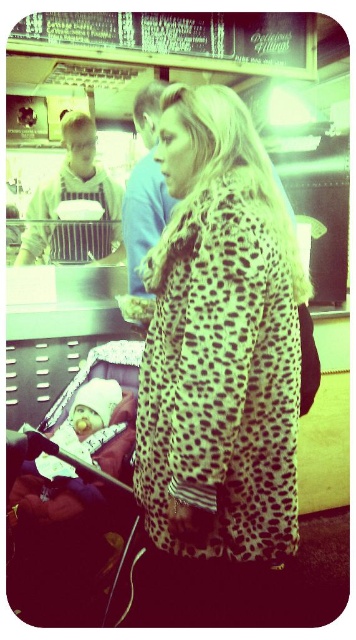
Between leopard print coat at center and soft pink fabric baby at center, which one appears on the right side from the viewer's perspective?

From the viewer's perspective, leopard print coat at center appears more on the right side.

Which is above, leopard print coat at center or soft pink fabric baby at center?

Positioned higher is leopard print coat at center.

Identify the location of leopard print coat at center. This screenshot has width=356, height=640. (220, 342).

This screenshot has width=356, height=640. Identify the location of leopard print coat at center. (220, 342).

Does leopard print coat at center have a greater height compared to metallic silver baby carriage at lower left?

Yes, leopard print coat at center is taller than metallic silver baby carriage at lower left.

Does leopard print coat at center have a larger size compared to metallic silver baby carriage at lower left?

Yes, leopard print coat at center is bigger than metallic silver baby carriage at lower left.

Find the location of a particular element. This screenshot has width=356, height=640. leopard print coat at center is located at coordinates [220, 342].

The width and height of the screenshot is (356, 640). I want to click on leopard print coat at center, so click(x=220, y=342).

Which of these two, metallic silver baby carriage at lower left or soft pink fabric baby at center, stands shorter?

Standing shorter between the two is soft pink fabric baby at center.

Is metallic silver baby carriage at lower left shorter than soft pink fabric baby at center?

No.

Between point (119, 440) and point (112, 429), which one is positioned behind?

Positioned behind is point (112, 429).

Locate an element on the screen. This screenshot has width=356, height=640. metallic silver baby carriage at lower left is located at coordinates 63,544.